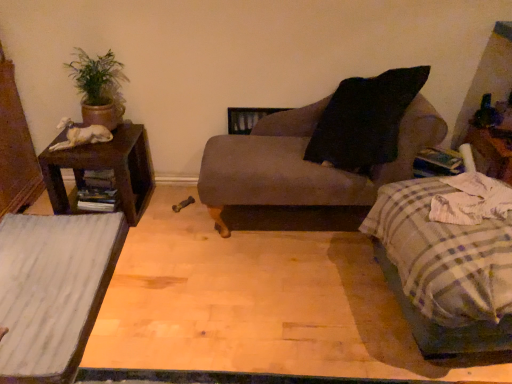
The width and height of the screenshot is (512, 384). I want to click on vacant area that lies between brown wood nightstand at left and matte gray chaise at center, so click(x=170, y=216).